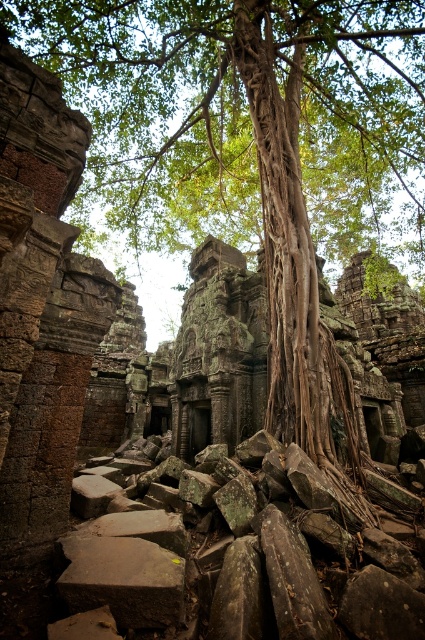
Looking at this image, who is shorter, brown rough tree trunk at center or brown rough stone at lower center?

brown rough stone at lower center

Can you confirm if brown rough tree trunk at center is thinner than brown rough stone at lower center?

No, brown rough tree trunk at center is not thinner than brown rough stone at lower center.

Locate an element on the screen. The height and width of the screenshot is (640, 425). brown rough tree trunk at center is located at coordinates (244, 118).